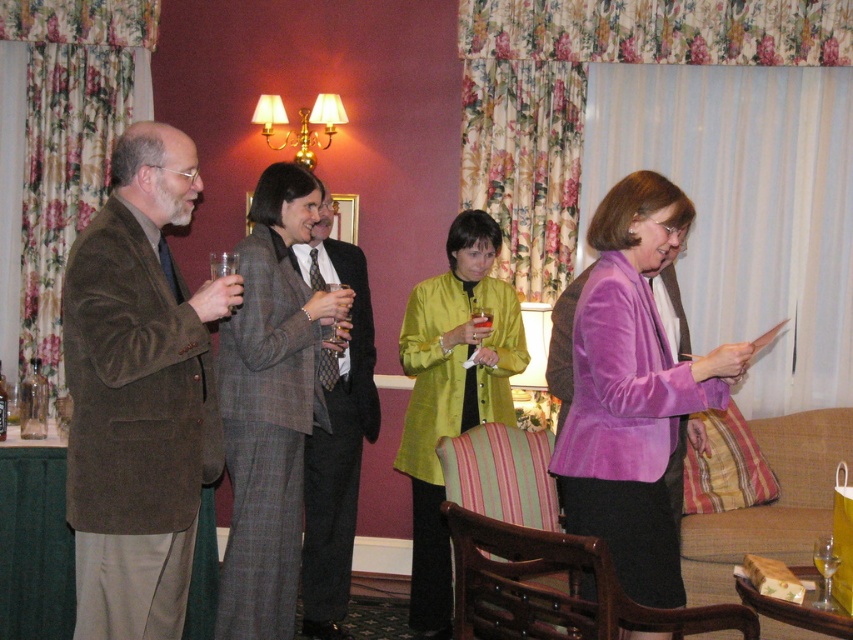
Is brown velvety blazer at left to the right of translucent glass beverage at center from the viewer's perspective?

Answer: Incorrect, brown velvety blazer at left is not on the right side of translucent glass beverage at center.

Between brown velvety blazer at left and translucent glass beverage at center, which one is positioned higher?

Positioned higher is translucent glass beverage at center.

What do you see at coordinates (138, 394) in the screenshot? This screenshot has width=853, height=640. I see `brown velvety blazer at left` at bounding box center [138, 394].

Where is `brown velvety blazer at left`? brown velvety blazer at left is located at coordinates (138, 394).

Which is in front, point (229, 428) or point (335, 548)?

Point (229, 428) is in front.

Is plaid wool suit at center to the right of gray wool suit at center from the viewer's perspective?

In fact, plaid wool suit at center is to the left of gray wool suit at center.

This screenshot has height=640, width=853. What do you see at coordinates (271, 403) in the screenshot?
I see `plaid wool suit at center` at bounding box center [271, 403].

Locate an element on the screen. This screenshot has height=640, width=853. plaid wool suit at center is located at coordinates (271, 403).

This screenshot has width=853, height=640. Identify the location of brown velvety blazer at left. (138, 394).

This screenshot has height=640, width=853. What do you see at coordinates (138, 394) in the screenshot? I see `brown velvety blazer at left` at bounding box center [138, 394].

Locate an element on the screen. brown velvety blazer at left is located at coordinates (138, 394).